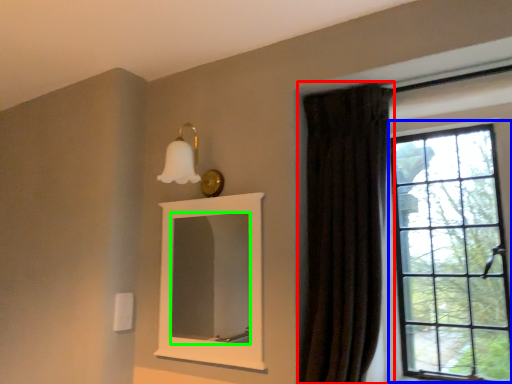
Question: Estimate the real-world distances between objects in this image. Which object is farther from curtain (highlighted by a red box), window (highlighted by a blue box) or mirror (highlighted by a green box)?

Choices:
 (A) window
 (B) mirror

Answer: (B)